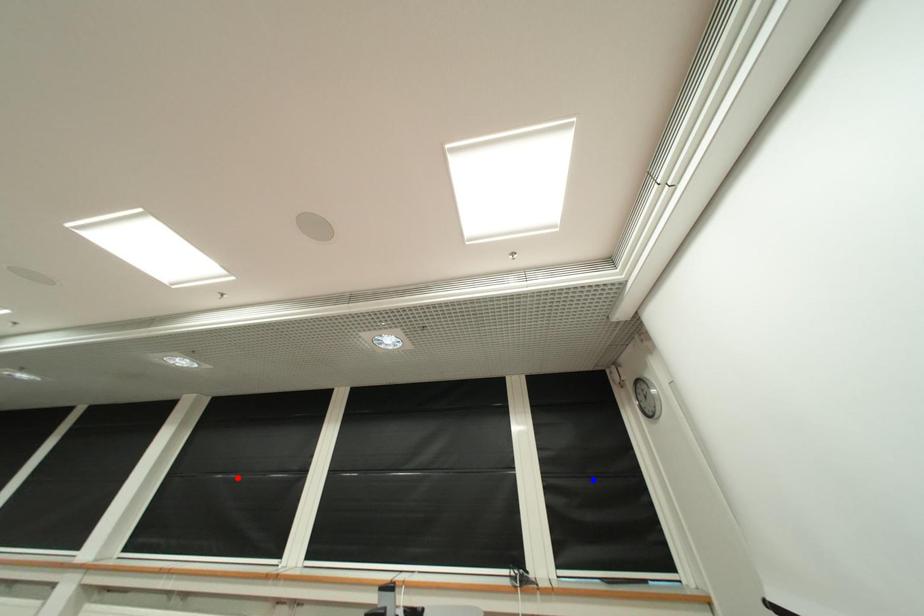
Question: Two points are marked on the image. Which point is closer to the camera?

Choices:
 (A) Blue point is closer.
 (B) Red point is closer.

Answer: (A)